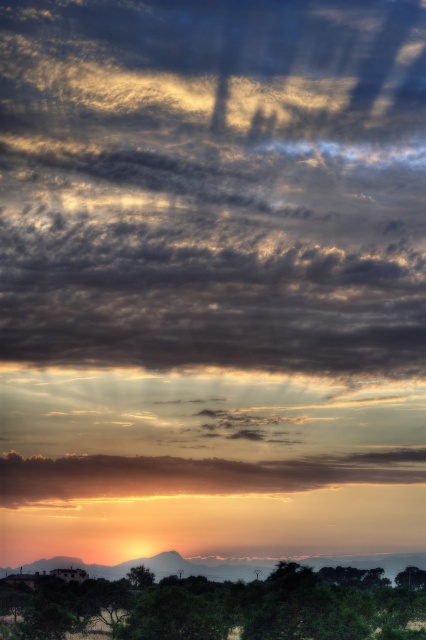
You are an artist trying to paint the sunset scene. You want to ensure the golden matte cloud at lower center and the green leafy tree at lower right are proportionally accurate. Which object should you paint taller?

The golden matte cloud at lower center should be painted taller since it has a greater height compared to the green leafy tree at lower right according to the description.

You are standing in the scene and want to walk from the golden matte cloud at lower center to the green leafy tree at lower right. Which direction should you head to reach the tree?

The golden matte cloud at lower center is to the left of the green leafy tree at lower right, so you should head to the right to reach the tree.